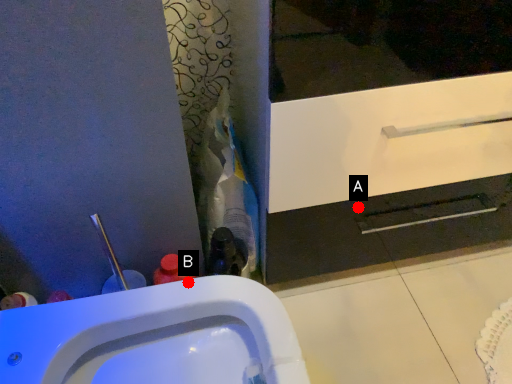
Question: Two points are circled on the image, labeled by A and B beside each circle. Which point is closer to the camera taking this photo?

Choices:
 (A) A is closer
 (B) B is closer

Answer: (B)